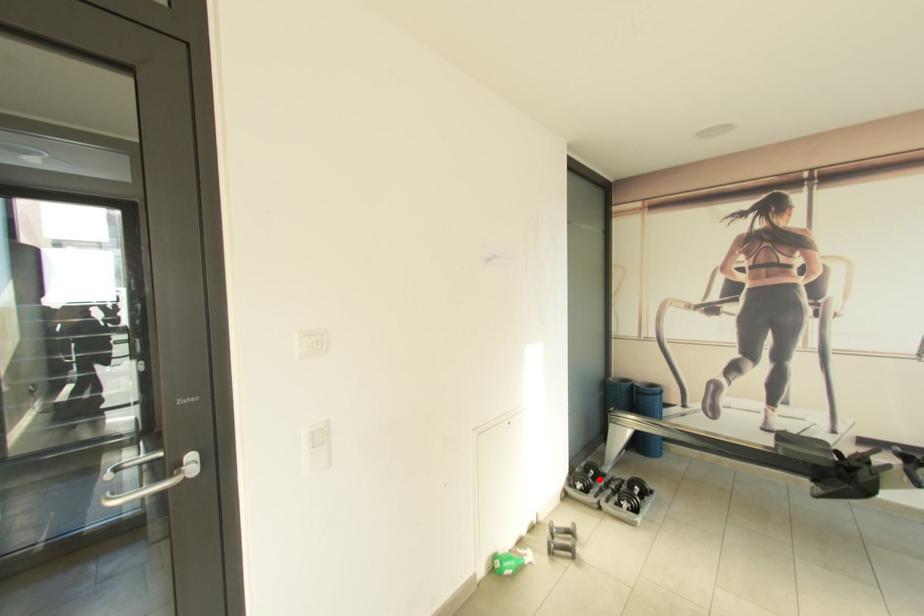
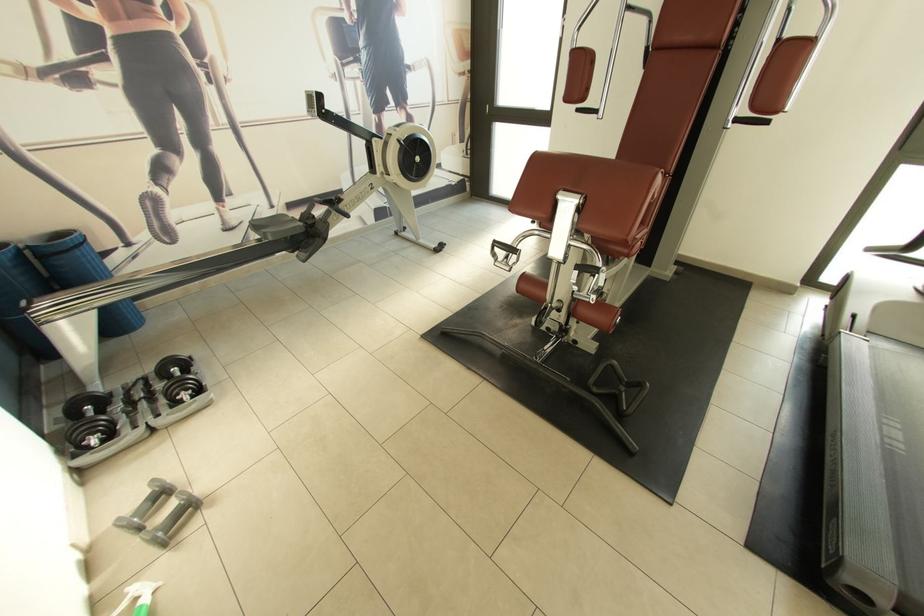
Question: I am providing you with two images of the same scene from different viewpoints. Image1 has a red point marked. In image2, the corresponding 3D location appears at what relative position? Reply with the corresponding letter.

Choices:
 (A) Closer
 (B) Farther

Answer: (B)